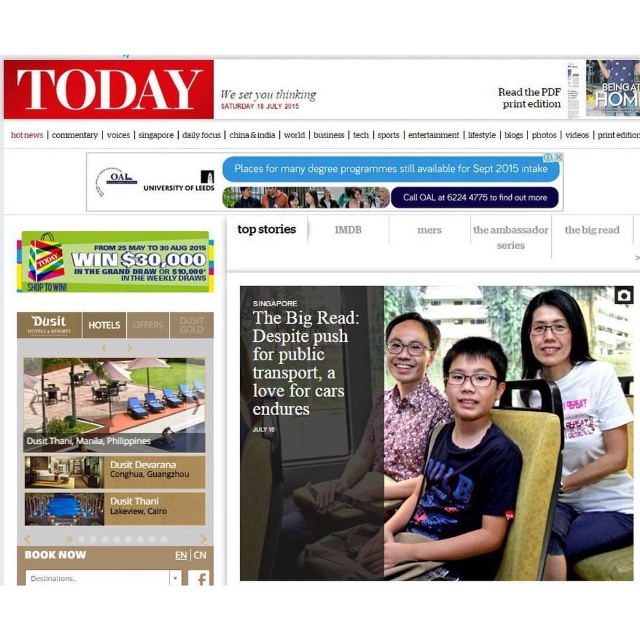
This screenshot has height=640, width=640. What do you see at coordinates (460, 477) in the screenshot?
I see `dark blue cotton t-shirt at center` at bounding box center [460, 477].

Is point (480, 419) farther from camera compared to point (244, 204)?

No, it is in front of (244, 204).

Who is more forward, [449,499] or [241,188]?

Positioned in front is point [449,499].

At what (x,y) coordinates should I click in order to perform the action: click on dark blue cotton t-shirt at center. Please return your answer as a coordinate pair (x, y). Looking at the image, I should click on (460, 477).

Which is below, matte brown shirt at center or matte black glasses at upper center?

matte brown shirt at center is lower down.

Is matte brown shirt at center positioned in front of matte black glasses at upper center?

Yes, it is in front of matte black glasses at upper center.

Measure the distance between matte brown shirt at center and camera.

2.23 meters

Where is `matte brown shirt at center`? matte brown shirt at center is located at coordinates (376, 442).

I want to click on dark blue cotton t-shirt at center, so click(x=460, y=477).

Which is above, dark blue cotton t-shirt at center or white cotton t-shirt at upper right?

white cotton t-shirt at upper right is higher up.

Is point (465, 422) less distant than point (525, 342)?

That is True.

What are the coordinates of `dark blue cotton t-shirt at center` in the screenshot? It's located at (460, 477).